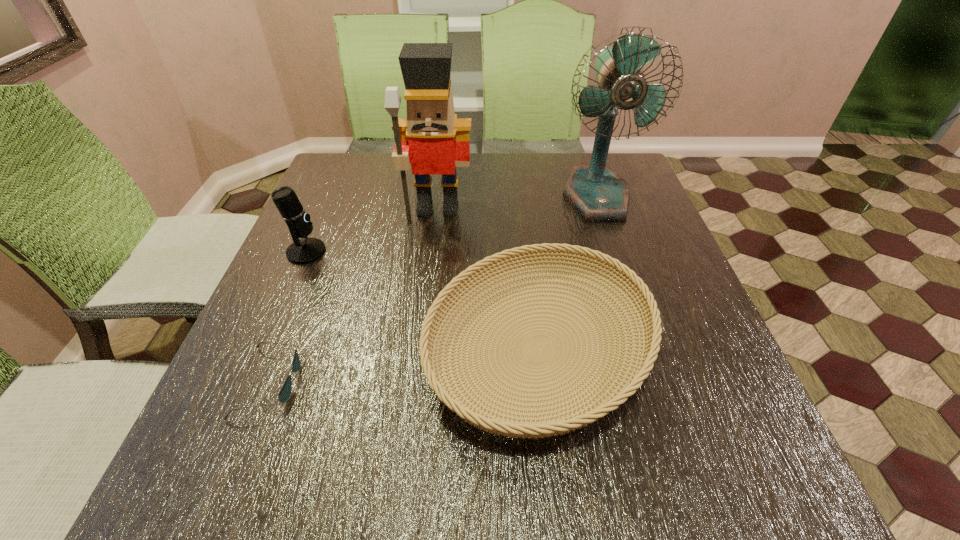
In order to click on vacant area between the third shortest object and the nutcracker in this screenshot , I will do `click(372, 230)`.

Find the location of a particular element. free space between the sunglasses and the basket is located at coordinates (404, 366).

In order to click on vacant area between the third tallest object and the nutcracker in this screenshot , I will do `click(372, 230)`.

Where is `free area in between the sunglasses and the fan`? free area in between the sunglasses and the fan is located at coordinates (433, 289).

Identify which object is the fourth closest to the basket. Please provide its 2D coordinates. Your answer should be formatted as a tuple, i.e. [(x, y)], where the tuple contains the x and y coordinates of a point satisfying the conditions above.

[(306, 250)]

Identify which object is located as the nearest to the third nearest object. Please provide its 2D coordinates. Your answer should be formatted as a tuple, i.e. [(x, y)], where the tuple contains the x and y coordinates of a point satisfying the conditions above.

[(432, 139)]

The image size is (960, 540). In order to click on free space that satisfies the following two spatial constraints: 1. in front of the nutcracker holding the staff; 2. on the lenses of the shortest object in this screenshot , I will do `click(417, 382)`.

Locate an element on the screen. Image resolution: width=960 pixels, height=540 pixels. free region that satisfies the following two spatial constraints: 1. in front of the nutcracker holding the staff; 2. on the lenses of the sunglasses is located at coordinates (417, 382).

What are the coordinates of `vacant area in the image that satisfies the following two spatial constraints: 1. in front of the fourth tallest object holding the staff; 2. on the right side of the nutcracker` in the screenshot? It's located at (420, 350).

The height and width of the screenshot is (540, 960). What are the coordinates of `free point that satisfies the following two spatial constraints: 1. on the front side of the basket; 2. on the left side of the third farthest object` in the screenshot? It's located at (264, 350).